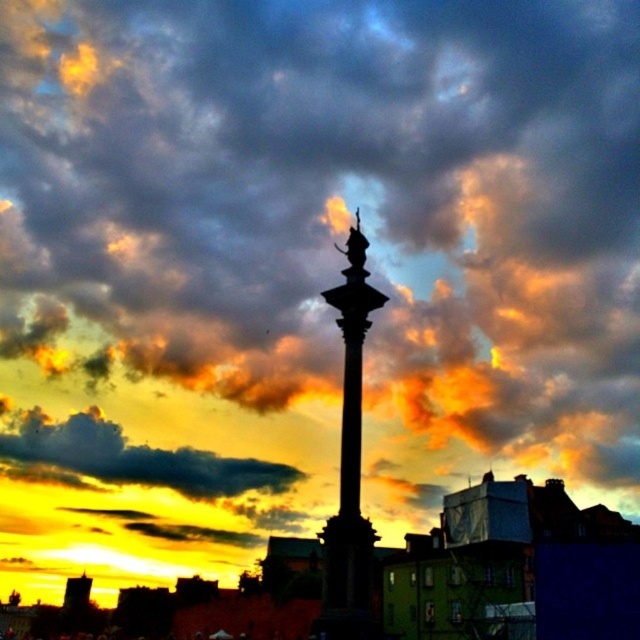
Question: Which of the following is the farthest from the observer?

Choices:
 (A) (176, 476)
 (B) (353, 467)

Answer: (A)

Question: Can you confirm if polished stone column at center is bigger than cloudy sky at upper center?

Choices:
 (A) yes
 (B) no

Answer: (B)

Question: Where is polished stone column at center located in relation to cloudy sky at upper center in the image?

Choices:
 (A) above
 (B) below

Answer: (A)

Question: Which of the following is the farthest from the observer?

Choices:
 (A) (300, 474)
 (B) (362, 529)

Answer: (A)

Question: Can you confirm if polished stone column at center is positioned below cloudy sky at upper center?

Choices:
 (A) yes
 (B) no

Answer: (B)